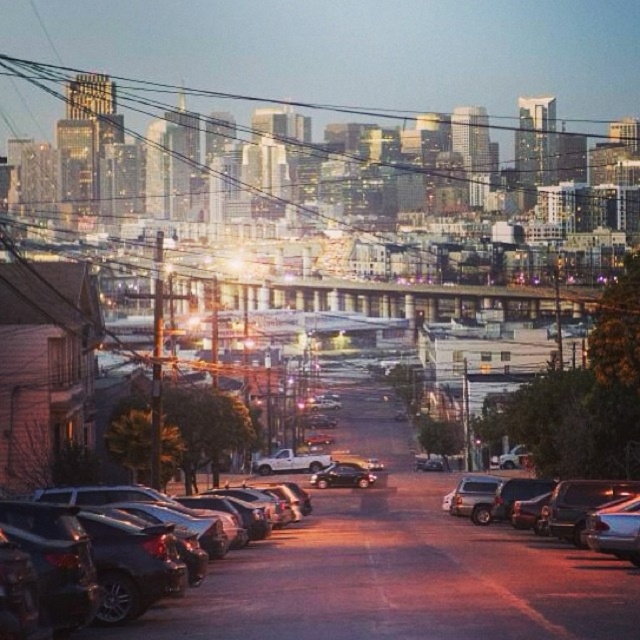
Question: Does metallic wire at upper center appear over satin black sedan at center?

Choices:
 (A) no
 (B) yes

Answer: (B)

Question: Does metallic wire at upper center appear over shiny silver sedan at lower right?

Choices:
 (A) no
 (B) yes

Answer: (B)

Question: Estimate the real-world distances between objects in this image. Which object is closer to the shiny black sedan at lower left?

Choices:
 (A) satin black sedan at center
 (B) metallic wire at upper center
 (C) shiny silver sedan at lower right

Answer: (C)

Question: Which object appears farthest from the camera in this image?

Choices:
 (A) metallic wire at upper center
 (B) shiny black sedan at lower left
 (C) satin black sedan at center

Answer: (A)

Question: Considering the real-world distances, which object is closest to the metallic wire at upper center?

Choices:
 (A) satin black sedan at center
 (B) shiny silver sedan at lower right
 (C) shiny black sedan at lower left

Answer: (A)

Question: Can you confirm if metallic wire at upper center is positioned below shiny silver sedan at lower right?

Choices:
 (A) yes
 (B) no

Answer: (B)